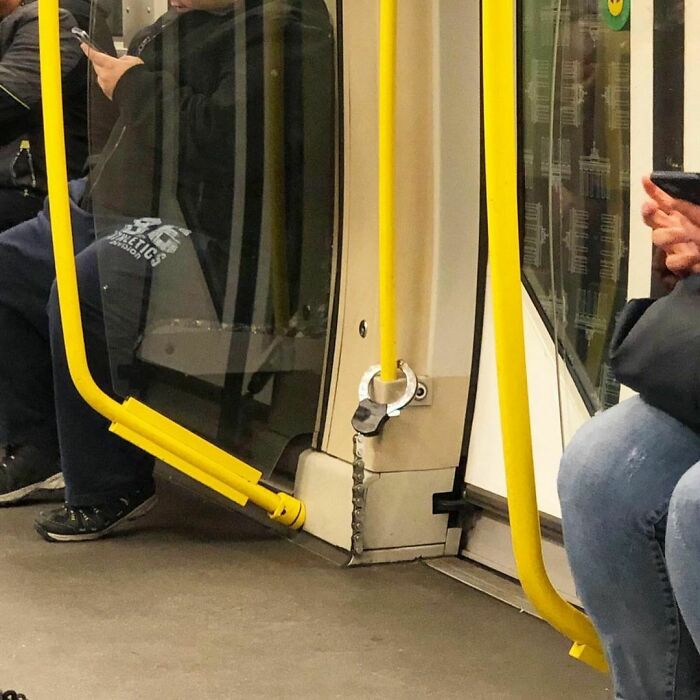
Where is `phone`? phone is located at coordinates (687, 187), (85, 40).